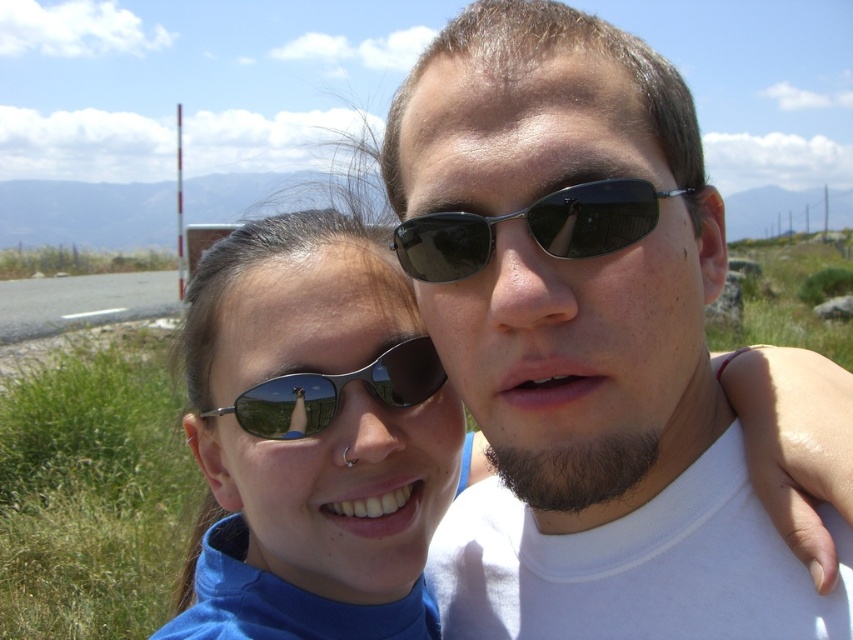
Question: Which is farther from the metallic reflective sunglasses at center?

Choices:
 (A) matte black sunglasses at center
 (B) matte black sunglasses at left
 (C) black plastic sunglasses at center

Answer: (A)

Question: From the image, what is the correct spatial relationship of matte black sunglasses at left in relation to black plastic sunglasses at center?

Choices:
 (A) below
 (B) above

Answer: (A)

Question: Is matte black sunglasses at center thinner than matte black sunglasses at left?

Choices:
 (A) no
 (B) yes

Answer: (B)

Question: Is matte black sunglasses at center thinner than metallic reflective sunglasses at center?

Choices:
 (A) yes
 (B) no

Answer: (B)

Question: Which of these objects is positioned closest to the matte black sunglasses at center?

Choices:
 (A) black plastic sunglasses at center
 (B) matte black sunglasses at left

Answer: (A)

Question: Which object appears farthest from the camera in this image?

Choices:
 (A) matte black sunglasses at center
 (B) matte black sunglasses at left
 (C) black plastic sunglasses at center
 (D) metallic reflective sunglasses at center

Answer: (D)